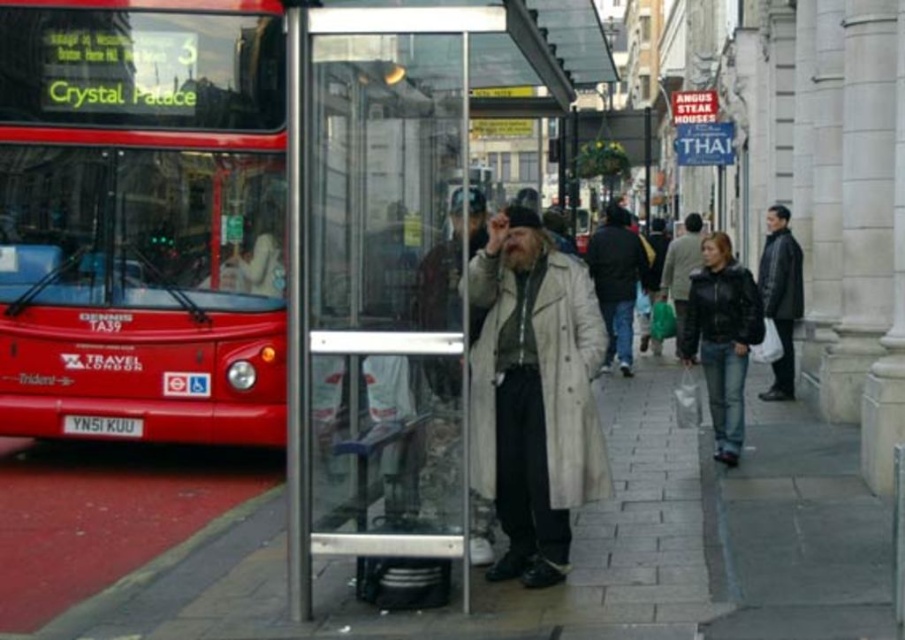
Is the position of transparent glass bus stop at center less distant than that of smooth concrete pavement at center?

No.

Based on the photo, is transparent glass bus stop at center wider than smooth concrete pavement at center?

Yes.

Which is behind, point (380, 337) or point (279, 524)?

Positioned behind is point (279, 524).

The height and width of the screenshot is (640, 905). What are the coordinates of `transparent glass bus stop at center` in the screenshot? It's located at (386, 260).

Does transparent glass bus stop at center have a lesser height compared to light beige textured trench coat at center?

No, transparent glass bus stop at center is not shorter than light beige textured trench coat at center.

Which is above, transparent glass bus stop at center or light beige textured trench coat at center?

transparent glass bus stop at center is higher up.

Does point (313, 401) lie behind point (487, 387)?

No.

At what (x,y) coordinates should I click in order to perform the action: click on transparent glass bus stop at center. Please return your answer as a coordinate pair (x, y). This screenshot has width=905, height=640. Looking at the image, I should click on (386, 260).

I want to click on red matte bus at left, so click(141, 220).

Can you confirm if red matte bus at left is positioned above light beige coat at center?

Indeed, red matte bus at left is positioned over light beige coat at center.

Does point (5, 3) come farther from viewer compared to point (435, 264)?

Yes, point (5, 3) is farther from viewer.

This screenshot has height=640, width=905. In order to click on red matte bus at left in this screenshot , I will do `click(141, 220)`.